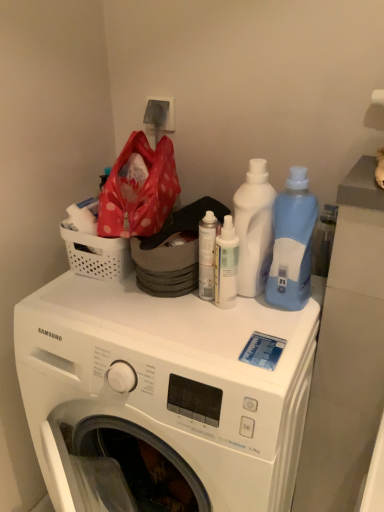
This screenshot has width=384, height=512. Identify the location of vacant point to the right of white glossy spray can at center, arranged as the 3th cleaning product when viewed from the right. (278, 311).